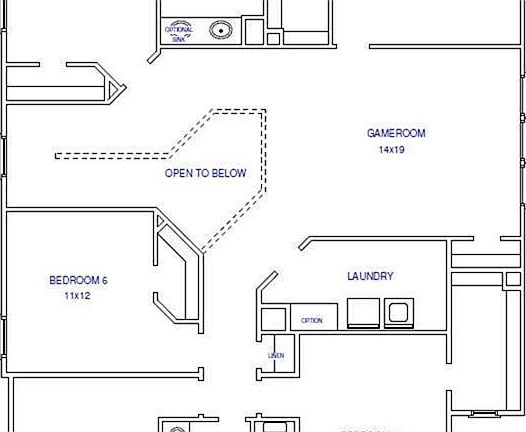
I want to click on washing machine, so click(x=412, y=313).